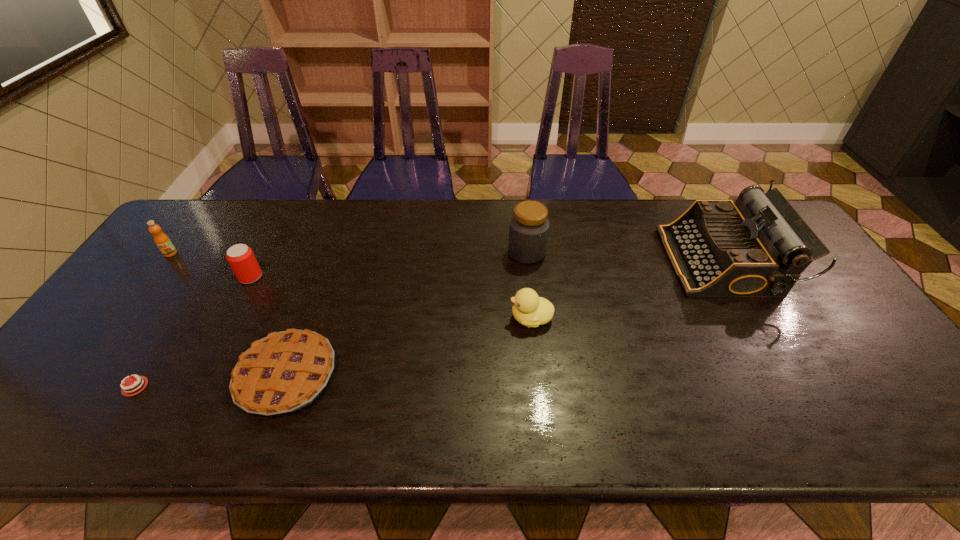
Image resolution: width=960 pixels, height=540 pixels. What are the coordinates of `object at the far right corner` in the screenshot? It's located at [x=758, y=246].

In order to click on vacant space at the far edge of the desktop in this screenshot , I will do `click(309, 211)`.

Find the location of a particular element. vacant space at the near edge of the desktop is located at coordinates (853, 422).

The width and height of the screenshot is (960, 540). In order to click on vacant region at the left edge in this screenshot , I will do `click(165, 298)`.

This screenshot has height=540, width=960. I want to click on vacant space at the far left corner, so click(x=194, y=232).

What are the coordinates of `vacant space at the near right corner of the desktop` in the screenshot? It's located at (871, 414).

Where is `blank region between the beer can and the chocolate cake`? This screenshot has width=960, height=540. blank region between the beer can and the chocolate cake is located at coordinates (193, 332).

Where is `vacant region between the duckling and the beer can`? vacant region between the duckling and the beer can is located at coordinates 391,298.

Find the location of a particular element. This screenshot has width=960, height=540. free area in between the leftmost object and the beer can is located at coordinates (210, 265).

Identify the location of vacant point located between the duckling and the typewriter. (627, 289).